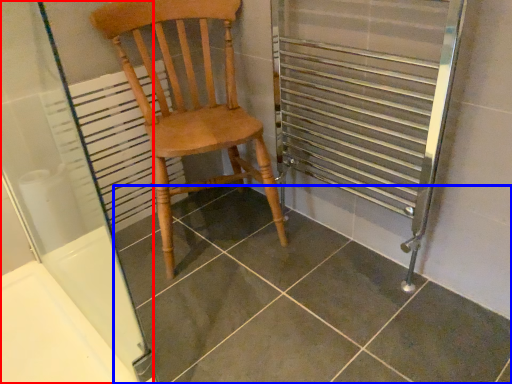
Question: Which of the following is the closest to the observer, screen door (highlighted by a red box) or tile (highlighted by a blue box)?

Choices:
 (A) screen door
 (B) tile

Answer: (A)